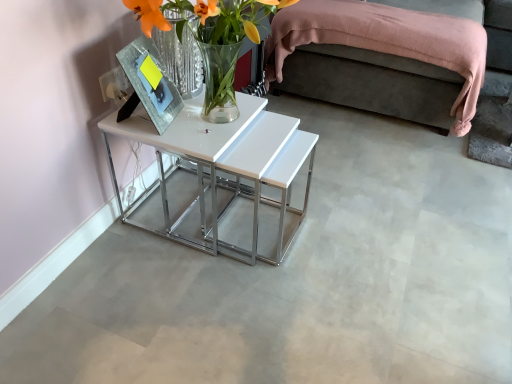
Question: Looking at their shapes, would you say pink fabric bed at upper right is wider or thinner than white glossy table at center?

Choices:
 (A) wide
 (B) thin

Answer: (B)

Question: From the image's perspective, is pink fabric bed at upper right above or below white glossy table at center?

Choices:
 (A) below
 (B) above

Answer: (B)

Question: Based on their relative distances, which object is farther from the pink fabric bed at upper right?

Choices:
 (A) translucent glass vase at center
 (B) white glossy table at center

Answer: (A)

Question: Which is nearer to the translucent glass vase at center?

Choices:
 (A) pink fabric bed at upper right
 (B) white glossy table at center

Answer: (B)